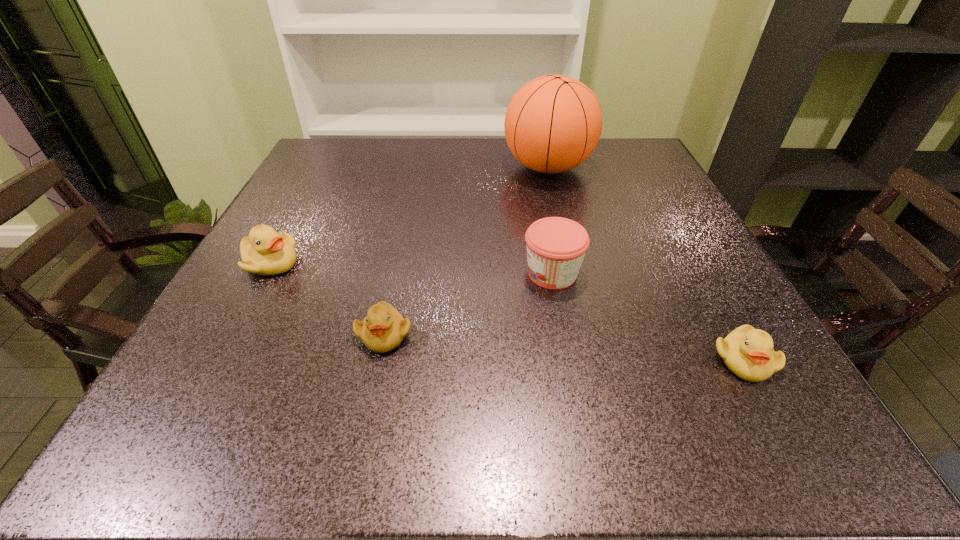
Where is `the farthest object`? the farthest object is located at coordinates (553, 123).

The height and width of the screenshot is (540, 960). What are the coordinates of `the tallest object` in the screenshot? It's located at (553, 123).

Image resolution: width=960 pixels, height=540 pixels. In order to click on jam in this screenshot , I will do `click(556, 246)`.

The height and width of the screenshot is (540, 960). I want to click on the tallest duckling, so click(265, 252).

Identify the location of the leftmost duckling. This screenshot has width=960, height=540. (265, 252).

Find the location of a particular element. Image resolution: width=960 pixels, height=540 pixels. the second duckling from right to left is located at coordinates (383, 329).

Identify the location of the rightmost duckling. This screenshot has height=540, width=960. (747, 352).

Where is `vacant space located on the right of the tallest object`? vacant space located on the right of the tallest object is located at coordinates (615, 167).

You are a GUI agent. You are given a task and a screenshot of the screen. Output one action in this format:
    pyautogui.click(x=<x>, y=<y>)
    Task: Click on the free space located 0.390m on the front label of the jam
    This screenshot has width=960, height=540.
    Given the screenshot: What is the action you would take?
    pyautogui.click(x=319, y=273)

Where is `blank space located 0.240m on the front label of the jam`? blank space located 0.240m on the front label of the jam is located at coordinates (396, 273).